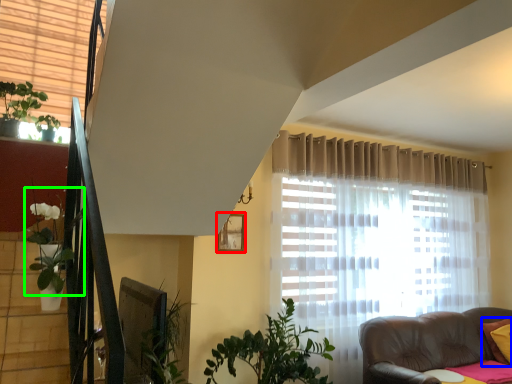
Question: Which is farther away from picture frame (highlighted by a red box)? pillow (highlighted by a blue box) or plant (highlighted by a green box)?

Choices:
 (A) pillow
 (B) plant

Answer: (A)